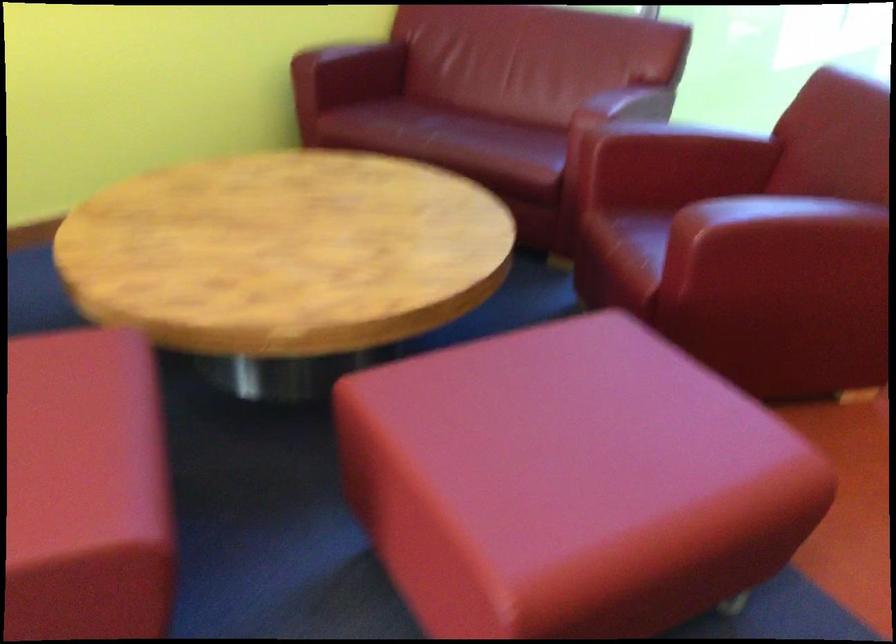
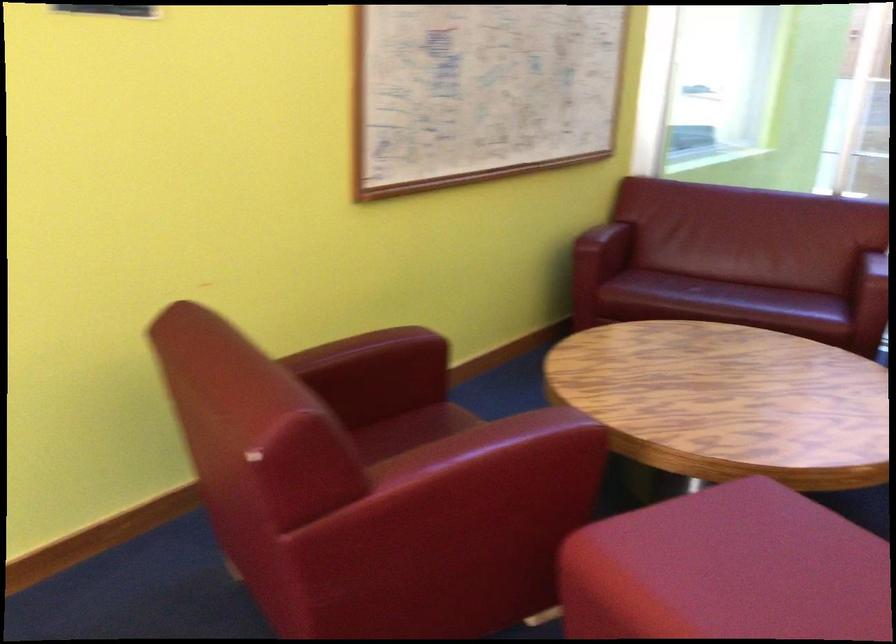
Where in the second image is the point corresponding to point (428, 131) from the first image?

(719, 297)